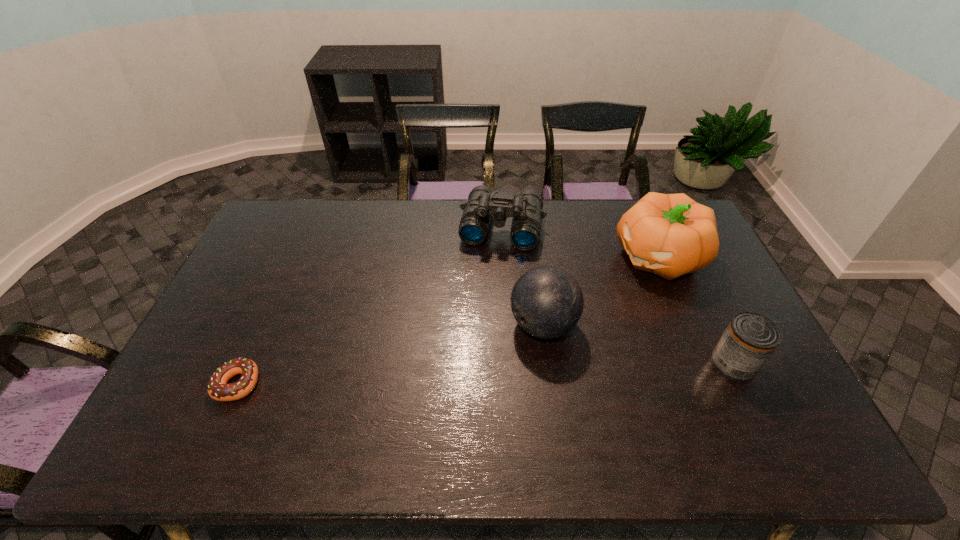
The image size is (960, 540). What are the coordinates of `the leftmost object` in the screenshot? It's located at (218, 389).

The height and width of the screenshot is (540, 960). Identify the location of doughnut. (218, 389).

I want to click on can, so click(x=750, y=338).

Locate an element on the screen. Image resolution: width=960 pixels, height=540 pixels. bowling ball is located at coordinates (547, 302).

The width and height of the screenshot is (960, 540). I want to click on binoculars, so click(x=483, y=203).

Locate an element on the screen. The width and height of the screenshot is (960, 540). pumpkin is located at coordinates (670, 235).

Where is `free space located 0.140m on the back of the leftmost object`? Image resolution: width=960 pixels, height=540 pixels. free space located 0.140m on the back of the leftmost object is located at coordinates (264, 323).

Where is `vacant region located 0.050m on the front of the can`? vacant region located 0.050m on the front of the can is located at coordinates (750, 400).

Locate an element on the screen. This screenshot has height=540, width=960. free space located 0.270m on the grip area of the second tallest object is located at coordinates (435, 389).

I want to click on free space located 0.230m on the grip area of the second tallest object, so click(x=447, y=381).